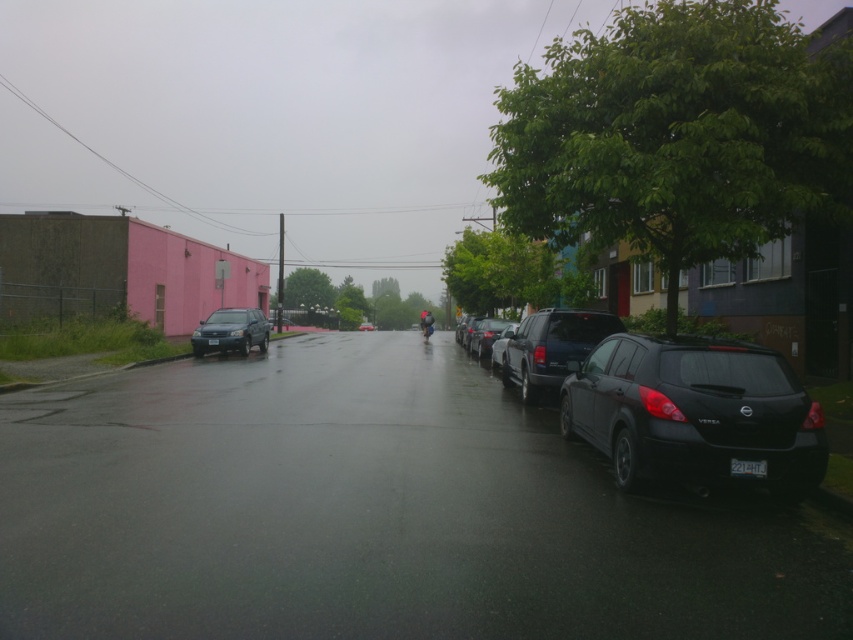
Can you confirm if matte black suv at right is positioned above satin black suv at center?

No, matte black suv at right is not above satin black suv at center.

Can you confirm if matte black suv at right is taller than satin black suv at center?

Yes.

This screenshot has height=640, width=853. Identify the location of matte black suv at right. (694, 412).

Does shiny dark blue suv at right appear under satin black sedan at center?

Indeed, shiny dark blue suv at right is positioned under satin black sedan at center.

Who is more forward, (601, 323) or (489, 340)?

Point (601, 323) is in front.

Does point (518, 362) come in front of point (503, 323)?

That is True.

Locate an element on the screen. Image resolution: width=853 pixels, height=640 pixels. shiny dark blue suv at right is located at coordinates (550, 348).

Does satin black sedan at left have a lesser width compared to satin black sedan at center?

No.

Does satin black sedan at left have a greater height compared to satin black sedan at center?

Indeed, satin black sedan at left has a greater height compared to satin black sedan at center.

Describe the element at coordinates (231, 332) in the screenshot. I see `satin black sedan at left` at that location.

Where is `satin black sedan at left`? The image size is (853, 640). satin black sedan at left is located at coordinates (231, 332).